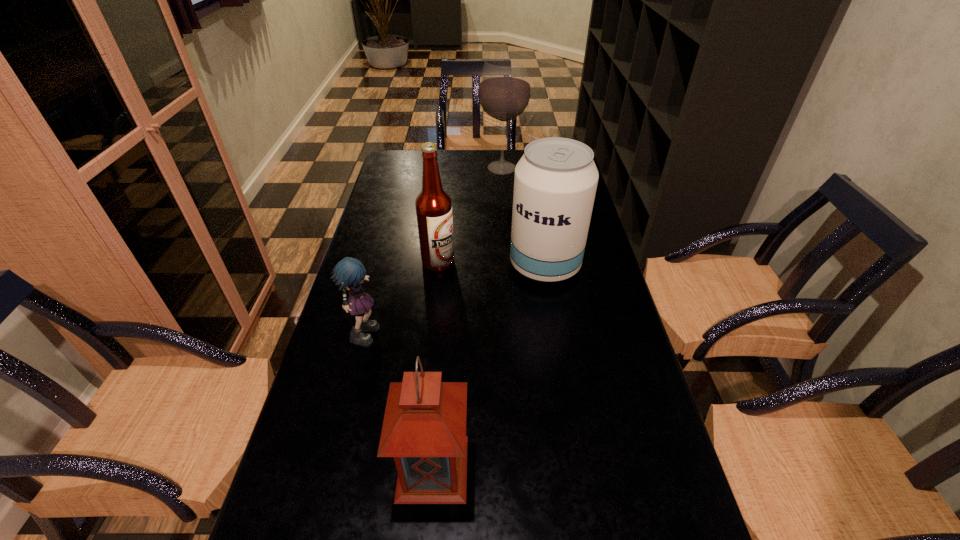
At what (x,y) coordinates should I click in order to perform the action: click on the farthest object. Please return your answer as a coordinate pair (x, y). Looking at the image, I should click on (504, 91).

Where is `the leftmost alcohol`? Image resolution: width=960 pixels, height=540 pixels. the leftmost alcohol is located at coordinates (433, 205).

Identify the location of the nearest object. (424, 428).

Find the location of a particular element. the shortest object is located at coordinates (349, 273).

Where is `the fourth farthest object`? The height and width of the screenshot is (540, 960). the fourth farthest object is located at coordinates (349, 273).

Find the location of a particular element. The height and width of the screenshot is (540, 960). vacant space located 0.170m on the left of the farthest object is located at coordinates (435, 168).

Where is `free region located on the label side of the leftmost alcohol`? free region located on the label side of the leftmost alcohol is located at coordinates (532, 262).

I want to click on blank area located 0.390m on the back of the nearest object, so click(x=446, y=301).

Identify the location of free spot located on the front-facing side of the leftmost object. Image resolution: width=960 pixels, height=540 pixels. [x=433, y=330].

I want to click on object located at the far edge, so click(x=504, y=91).